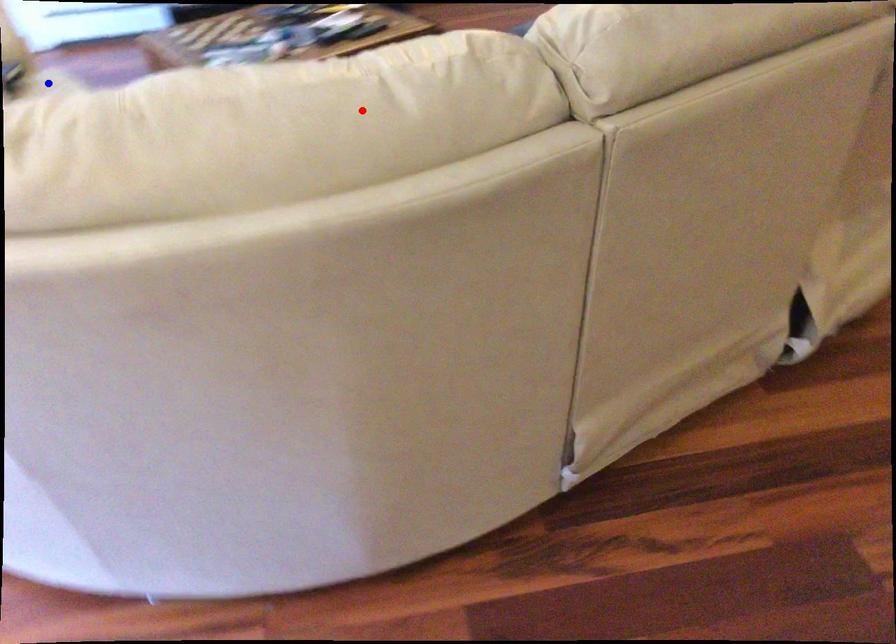
Question: Which of the two points in the image is closer to the camera?

Choices:
 (A) Blue point is closer.
 (B) Red point is closer.

Answer: (B)